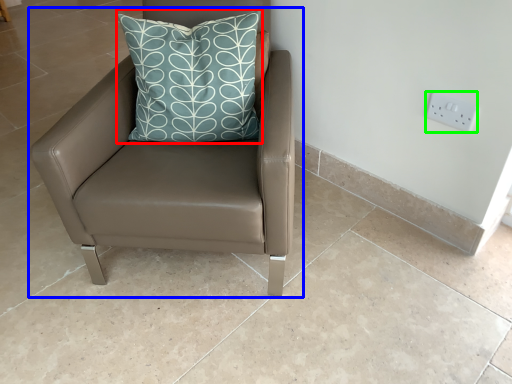
Question: Estimate the real-world distances between objects in this image. Which object is closer to pillow (highlighted by a red box), chair (highlighted by a blue box) or electric outlet (highlighted by a green box)?

Choices:
 (A) chair
 (B) electric outlet

Answer: (A)